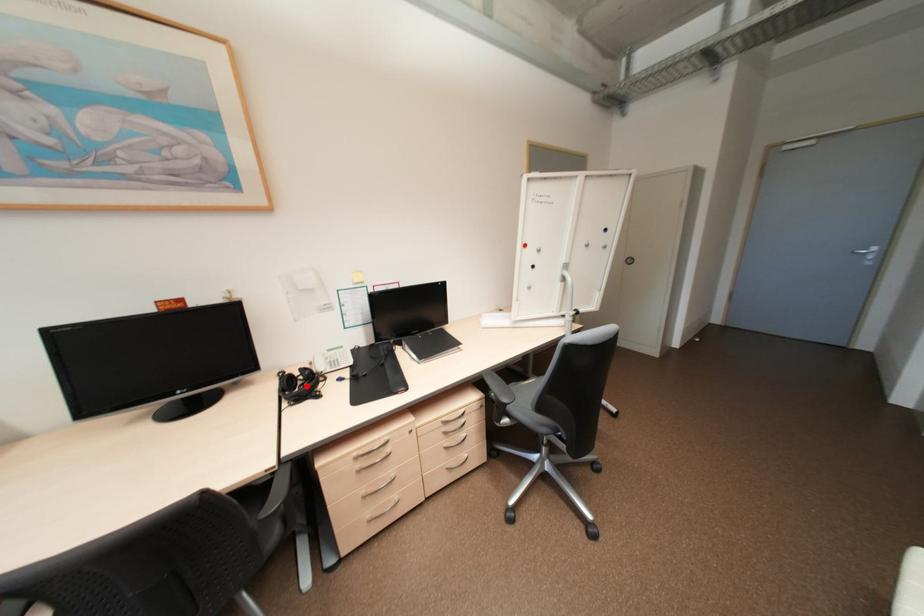
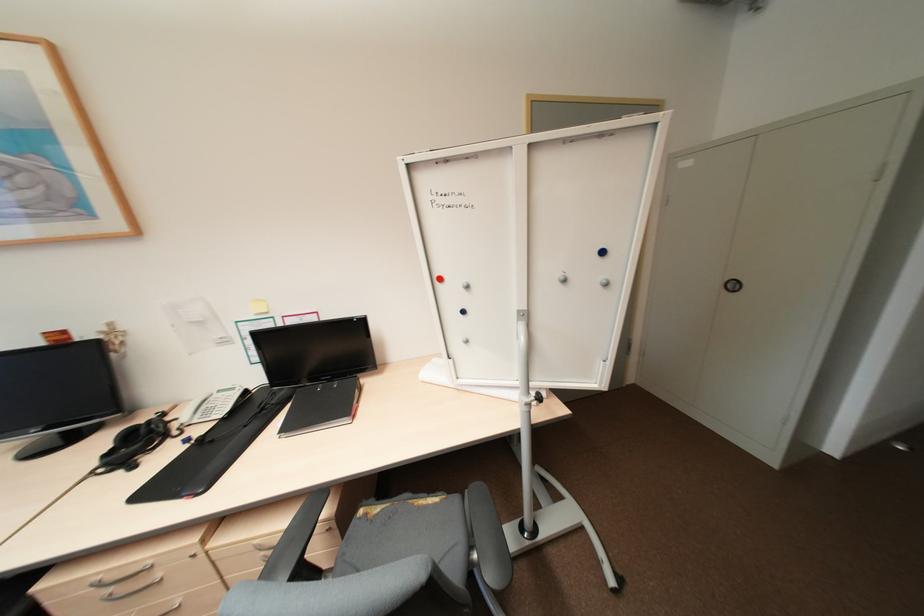
The point at the highlighted location is marked in the first image. Where is the corresponding point in the second image?

(142, 444)